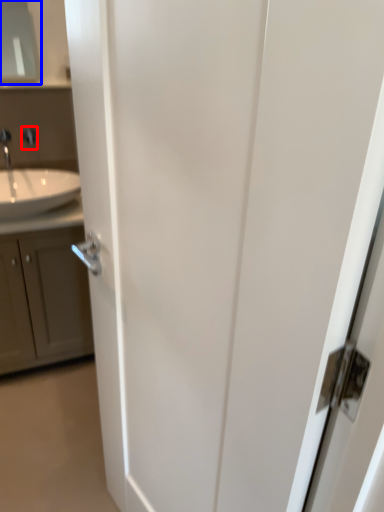
Question: Which of the following is the farthest to the observer, faucet (highlighted by a red box) or medicine cabinet (highlighted by a blue box)?

Choices:
 (A) faucet
 (B) medicine cabinet

Answer: (A)